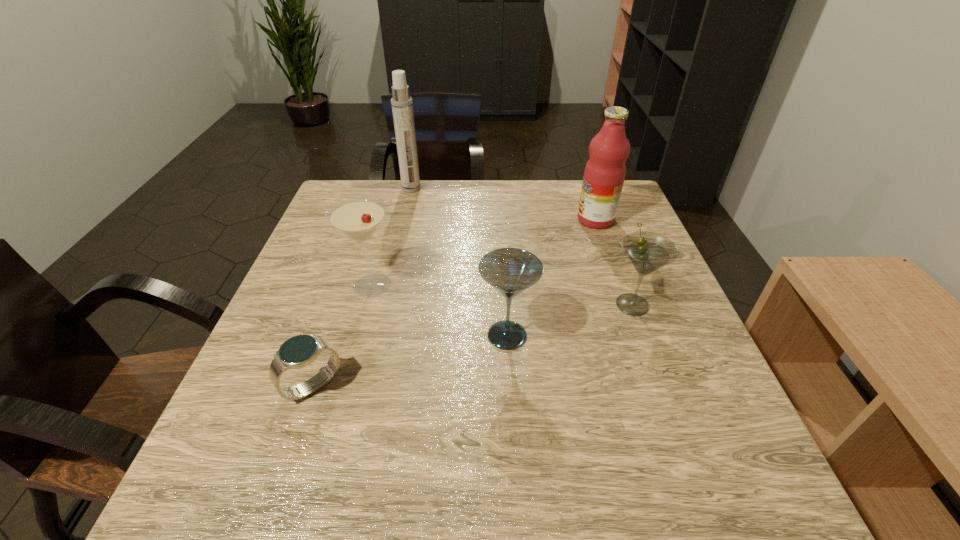
Locate an element on the screen. This screenshot has height=540, width=960. martini present at the right edge is located at coordinates (647, 251).

Identify the location of object that is at the far right corner. (604, 174).

I want to click on vacant space at the far edge, so click(468, 192).

Image resolution: width=960 pixels, height=540 pixels. In the image, there is a desktop. Find the location of `vacant space at the near edge`. vacant space at the near edge is located at coordinates (468, 500).

I want to click on vacant space at the left edge of the desktop, so click(x=267, y=357).

The height and width of the screenshot is (540, 960). I want to click on free region at the right edge, so click(650, 318).

The image size is (960, 540). I want to click on vacant space at the near right corner, so click(x=753, y=484).

The image size is (960, 540). I want to click on vacant area between the farthest object and the fruit juice, so click(x=503, y=204).

This screenshot has width=960, height=540. Identify the location of empty space between the rightmost martini and the watch. (472, 345).

Locate an element on the screen. This screenshot has height=540, width=960. vacant area that lies between the fruit juice and the third object from right to left is located at coordinates (551, 278).